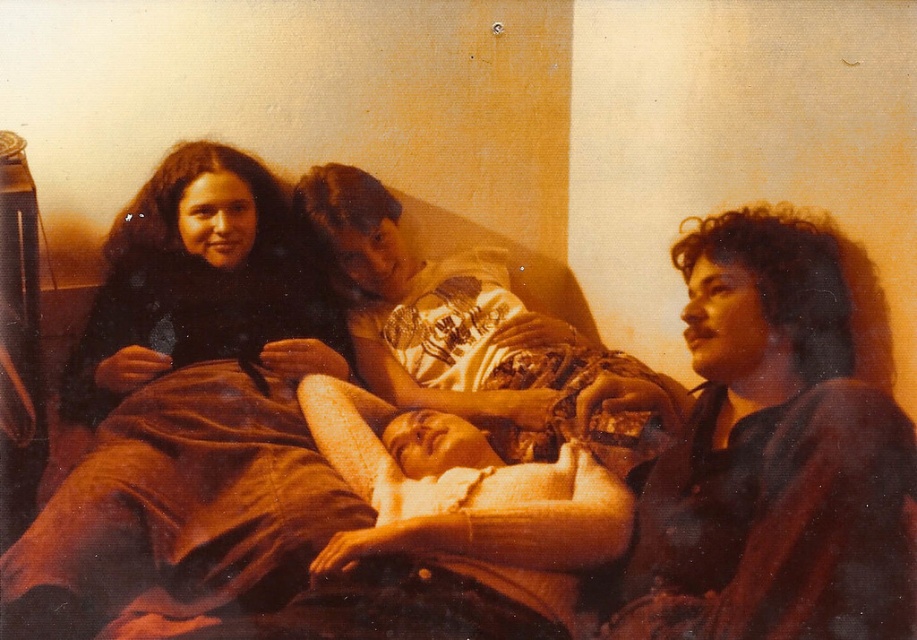
Can you confirm if dark brown hair at right is bigger than matte white shirt at center?

Incorrect, dark brown hair at right is not larger than matte white shirt at center.

Is dark brown hair at right positioned behind matte white shirt at center?

That is False.

Is point (897, 468) in front of point (481, 323)?

Yes, it is in front of point (481, 323).

The height and width of the screenshot is (640, 917). Find the location of `dark brown hair at right`. dark brown hair at right is located at coordinates (772, 456).

Is matte white shirt at center to the left of dark brown fur scarf at left from the viewer's perspective?

No, matte white shirt at center is not to the left of dark brown fur scarf at left.

Is matte white shirt at center below dark brown fur scarf at left?

Yes.

Is point (445, 284) behind point (146, 268)?

Yes, it is behind point (146, 268).

This screenshot has width=917, height=640. Find the location of `matte white shirt at center`. matte white shirt at center is located at coordinates (462, 332).

Does dark brown hair at right have a greater height compared to dark brown fur scarf at left?

Correct, dark brown hair at right is much taller as dark brown fur scarf at left.

Is dark brown hair at right closer to the viewer compared to dark brown fur scarf at left?

Yes.

You are a GUI agent. You are given a task and a screenshot of the screen. Output one action in this format:
    pyautogui.click(x=<x>, y=<y>)
    Task: Click on the dark brown hair at right
    This screenshot has height=640, width=917.
    Given the screenshot: What is the action you would take?
    pyautogui.click(x=772, y=456)

This screenshot has width=917, height=640. In order to click on dark brown hair at right in this screenshot , I will do `click(772, 456)`.